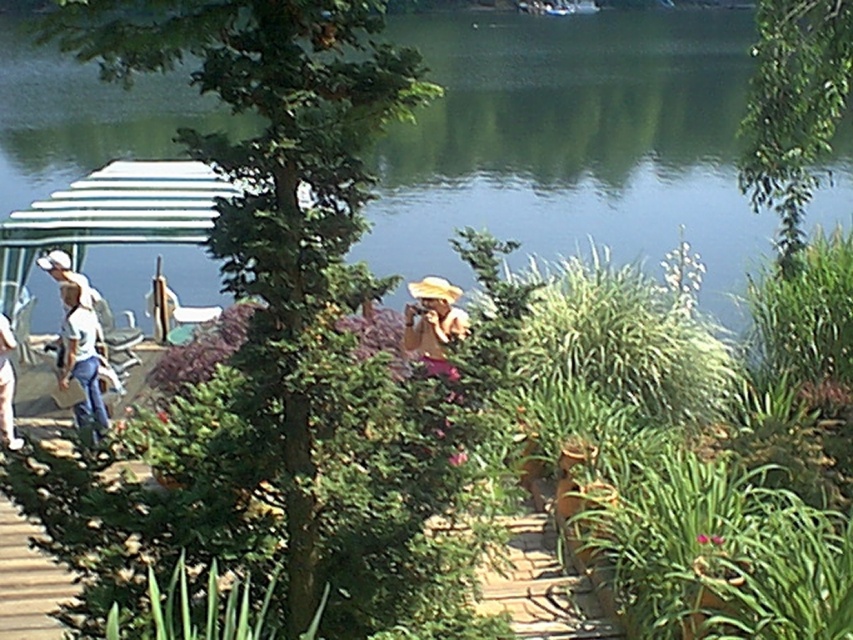
You are a photographer positioned at the lakeside. You want to capture a photo that includes both the green leafy plant at center and the pink fabric at center. Which object should you adjust your focus on first to ensure both are in the frame?

Since the green leafy plant at center is closer to the viewer than the pink fabric at center, you should focus on the green leafy plant at center first to ensure depth of field captures both objects.